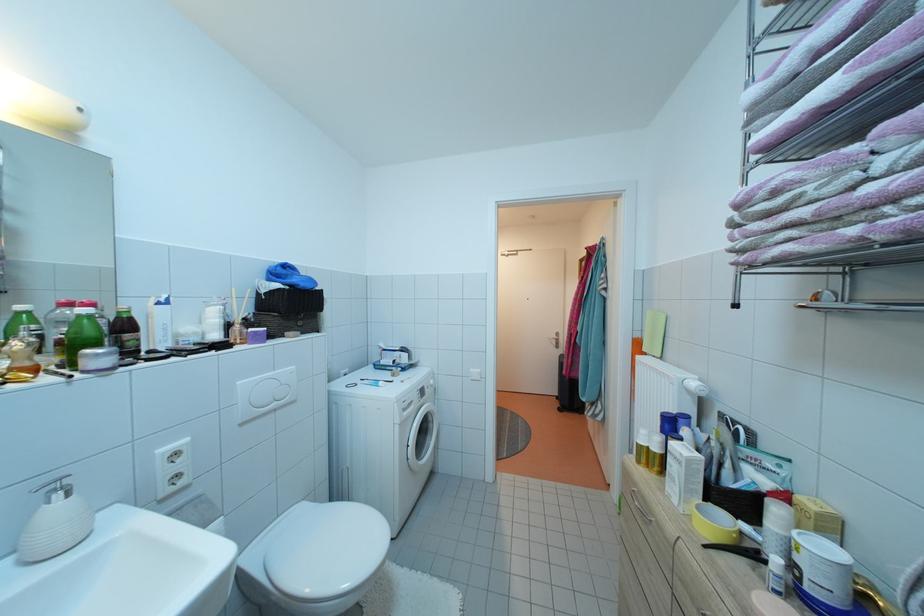
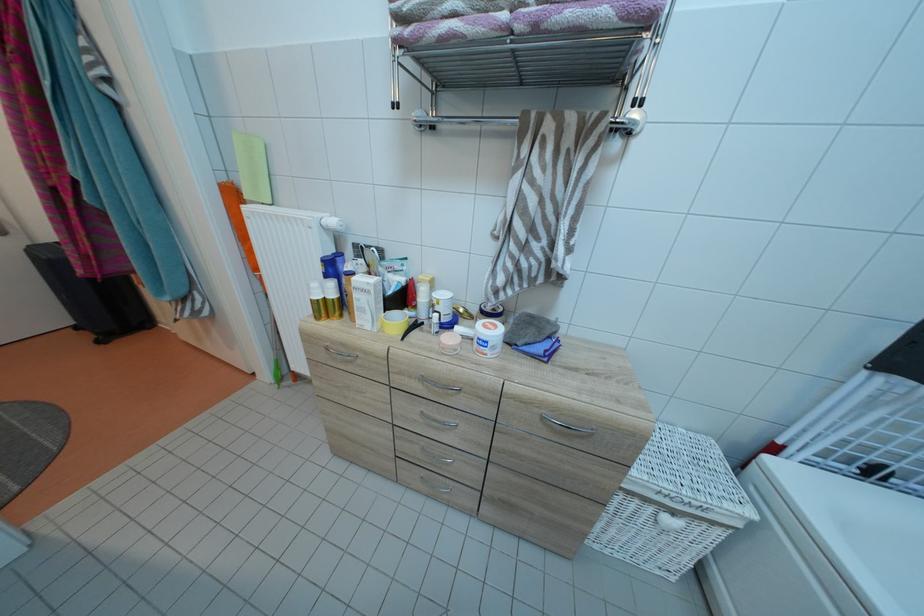
The point at (699, 391) is marked in the first image. Where is the corresponding point in the second image?

(341, 227)